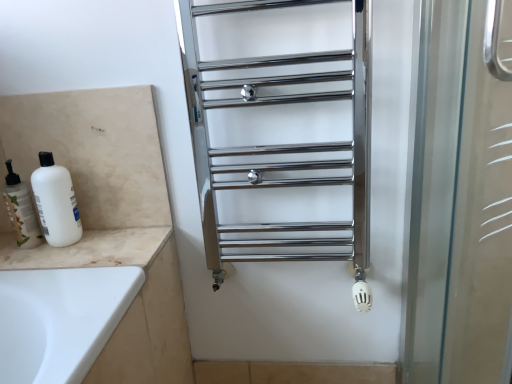
Question: Is white matte bottle at left situated inside polished chrome towel rack at center or outside?

Choices:
 (A) outside
 (B) inside

Answer: (A)

Question: Considering the positions of white matte bottle at left and polished chrome towel rack at center in the image, is white matte bottle at left bigger or smaller than polished chrome towel rack at center?

Choices:
 (A) small
 (B) big

Answer: (A)

Question: Which of these objects is positioned closest to the white matte bottle at left?

Choices:
 (A) beige marble counter top at lower left
 (B) polished chrome towel rack at center
 (C) white matte bottle at left

Answer: (C)

Question: Estimate the real-world distances between objects in this image. Which object is closer to the polished chrome towel rack at center?

Choices:
 (A) white matte bottle at left
 (B) beige marble counter top at lower left
 (C) white matte bottle at left

Answer: (B)